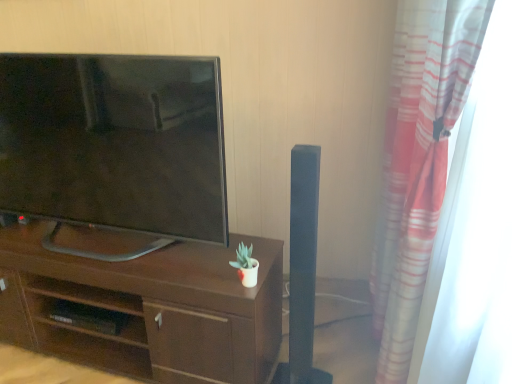
Find the location of `dark wood desk at center`. dark wood desk at center is located at coordinates (148, 309).

The image size is (512, 384). Identify the location of matte black tv at left. (115, 146).

Considering the relative sizes of striped fabric curtain at right and dark wood desk at center in the image provided, is striped fabric curtain at right wider than dark wood desk at center?

Incorrect, the width of striped fabric curtain at right does not surpass that of dark wood desk at center.

From the image's perspective, is striped fabric curtain at right below dark wood desk at center?

Actually, striped fabric curtain at right appears above dark wood desk at center in the image.

From a real-world perspective, between striped fabric curtain at right and dark wood desk at center, who is vertically lower?

dark wood desk at center, from a real-world perspective.

Considering the relative sizes of striped fabric curtain at right and dark wood desk at center in the image provided, is striped fabric curtain at right bigger than dark wood desk at center?

Correct, striped fabric curtain at right is larger in size than dark wood desk at center.

Considering the points (142, 175) and (10, 330), which point is behind, point (142, 175) or point (10, 330)?

The point (10, 330) is farther.

Can you tell me how much matte black tv at left and dark wood desk at center differ in facing direction?

There is a 0.974-degree angle between the facing directions of matte black tv at left and dark wood desk at center.

Between matte black tv at left and dark wood desk at center, which one has larger width?

dark wood desk at center is wider.

Does matte black tv at left have a greater height compared to dark wood desk at center?

Indeed, matte black tv at left has a greater height compared to dark wood desk at center.

Is matte black tv at left facing away from striped fabric curtain at right?

No, matte black tv at left's orientation is not away from striped fabric curtain at right.

Between point (193, 176) and point (398, 43), which one is positioned in front?

The point (193, 176) is closer.

From a real-world perspective, who is located lower, matte black tv at left or striped fabric curtain at right?

From a 3D spatial view, striped fabric curtain at right is below.

Does matte black tv at left have a greater width compared to striped fabric curtain at right?

Correct, the width of matte black tv at left exceeds that of striped fabric curtain at right.

Does striped fabric curtain at right have a greater height compared to matte black tv at left?

Yes.

Which is correct: striped fabric curtain at right is inside matte black tv at left, or outside of it?

The correct answer is: outside.

Considering the positions of objects striped fabric curtain at right and matte black tv at left in the image provided, who is behind, striped fabric curtain at right or matte black tv at left?

matte black tv at left is further from the camera.

Considering the points (464, 59) and (203, 194), which point is behind, point (464, 59) or point (203, 194)?

The point (203, 194) is farther.

Is dark wood desk at center thinner than striped fabric curtain at right?

No, dark wood desk at center is not thinner than striped fabric curtain at right.

Which is more to the right, dark wood desk at center or striped fabric curtain at right?

striped fabric curtain at right is more to the right.

Is dark wood desk at center spatially inside striped fabric curtain at right, or outside of it?

dark wood desk at center is outside striped fabric curtain at right.

Where is `television located above the dark wood desk at center (from the image's perspective)`? The height and width of the screenshot is (384, 512). television located above the dark wood desk at center (from the image's perspective) is located at coordinates (115, 146).

Is matte black tv at left located within dark wood desk at center?

No, matte black tv at left is not a part of dark wood desk at center.

Does dark wood desk at center have a larger size compared to matte black tv at left?

Indeed, dark wood desk at center has a larger size compared to matte black tv at left.

At what (x,y) coordinates should I click in order to perform the action: click on desk below the striped fabric curtain at right (from the image's perspective). Please return your answer as a coordinate pair (x, y). This screenshot has height=384, width=512. Looking at the image, I should click on (148, 309).

Image resolution: width=512 pixels, height=384 pixels. Identify the location of television lying in front of the dark wood desk at center. (115, 146).

Which object lies nearer to the anchor point matte black tv at left, striped fabric curtain at right or dark wood desk at center?

dark wood desk at center is positioned closer to the anchor matte black tv at left.

Considering their positions, is matte black tv at left positioned closer to dark wood desk at center than striped fabric curtain at right?

Based on the image, matte black tv at left appears to be nearer to dark wood desk at center.

Looking at the image, which one is located closer to matte black tv at left, dark wood desk at center or striped fabric curtain at right?

dark wood desk at center lies closer to matte black tv at left than the other object.

Which object lies nearer to the anchor point striped fabric curtain at right, matte black tv at left or dark wood desk at center?

dark wood desk at center lies closer to striped fabric curtain at right than the other object.

Based on their spatial positions, is dark wood desk at center or matte black tv at left closer to striped fabric curtain at right?

Based on the image, dark wood desk at center appears to be nearer to striped fabric curtain at right.

Based on the photo, looking at the image, which one is located further to dark wood desk at center, striped fabric curtain at right or matte black tv at left?

striped fabric curtain at right lies further to dark wood desk at center than the other object.

Where is `desk between matte black tv at left and striped fabric curtain at right`? desk between matte black tv at left and striped fabric curtain at right is located at coordinates (148, 309).